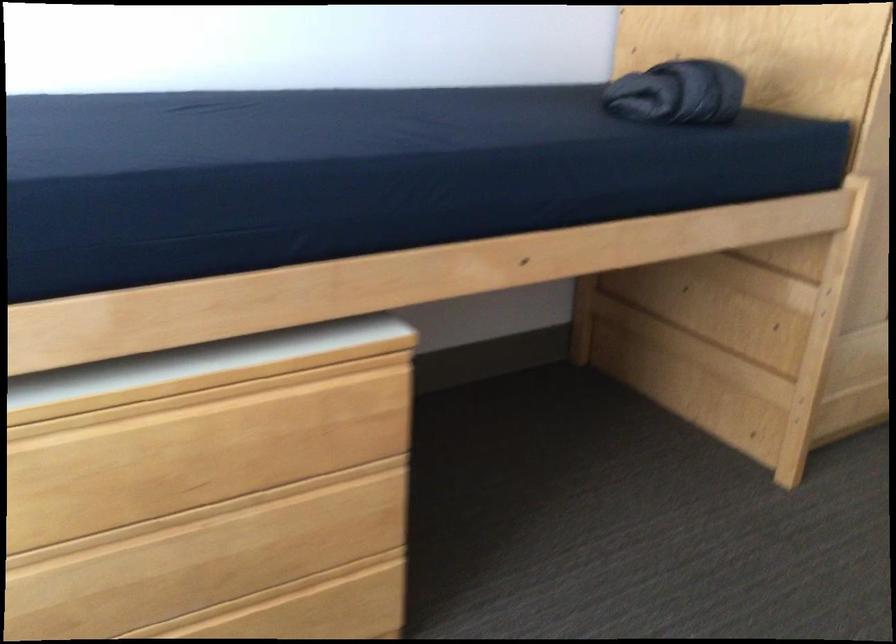
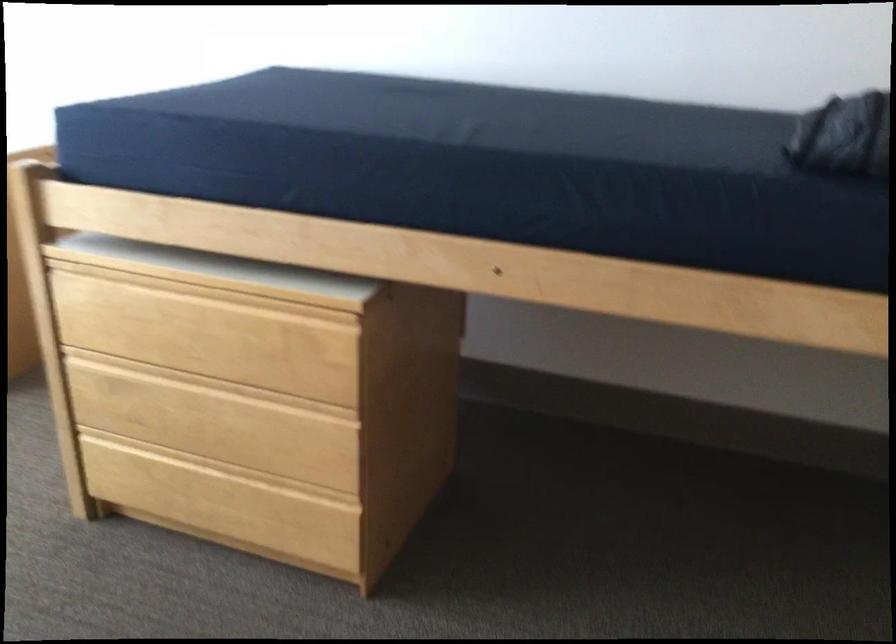
Locate, in the second image, the point that corresponds to the point at 187,370 in the first image.

(217, 272)